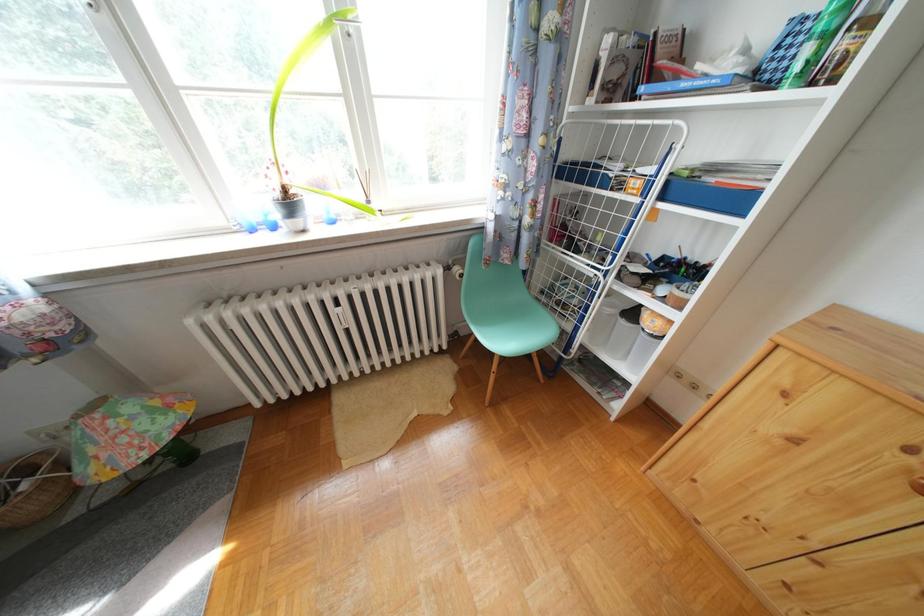
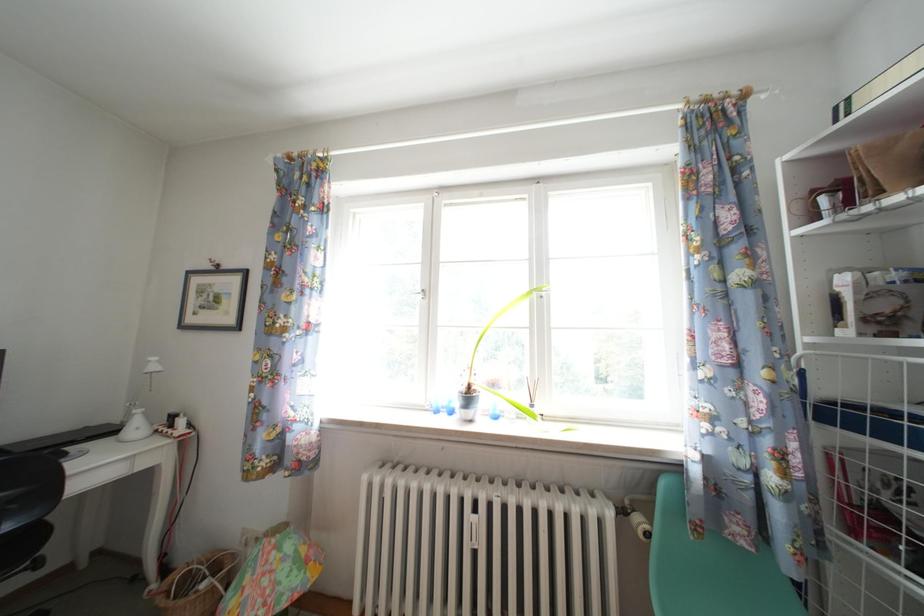
Based on the continuous images, in which direction is the camera rotating?

The rotation direction of the camera is left-up.